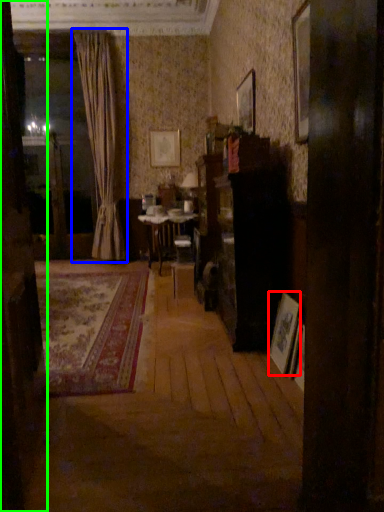
Question: Which object is the farthest from picture frame (highlighted by a red box)? Choose among these: curtain (highlighted by a blue box) or door (highlighted by a green box).

Choices:
 (A) curtain
 (B) door

Answer: (A)